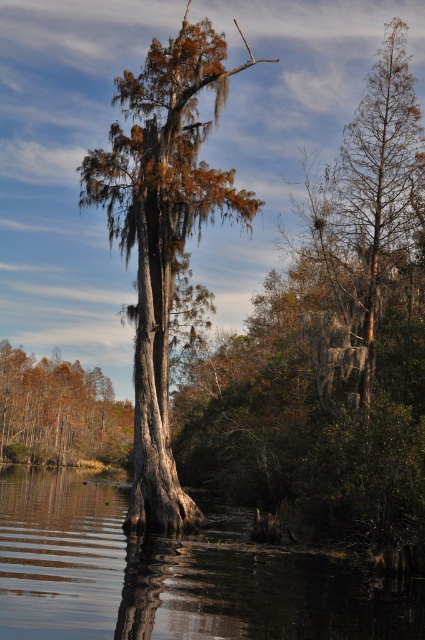
Question: Which object is the farthest from the brown matte tree at left?

Choices:
 (A) transparent water at center
 (B) smooth gray bark cypress at center

Answer: (B)

Question: Which point is farther to the camera?

Choices:
 (A) (159, 243)
 (B) (73, 413)

Answer: (B)

Question: Where is transparent water at center located in relation to brown matte tree at left in the image?

Choices:
 (A) right
 (B) left

Answer: (A)

Question: Is transparent water at center to the right of brown matte tree at left from the viewer's perspective?

Choices:
 (A) no
 (B) yes

Answer: (B)

Question: Can you confirm if transparent water at center is bigger than smooth gray bark cypress at center?

Choices:
 (A) no
 (B) yes

Answer: (A)

Question: Which object is positioned farthest from the transparent water at center?

Choices:
 (A) brown matte tree at left
 (B) smooth gray bark cypress at center

Answer: (A)